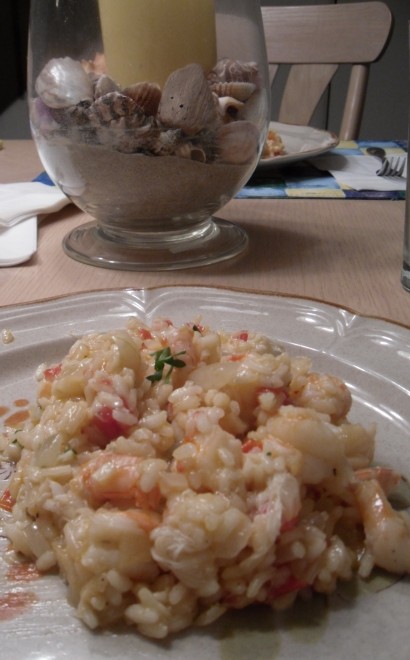
What are the coordinates of `napkin pile` in the screenshot? It's located at (24, 259), (26, 193).